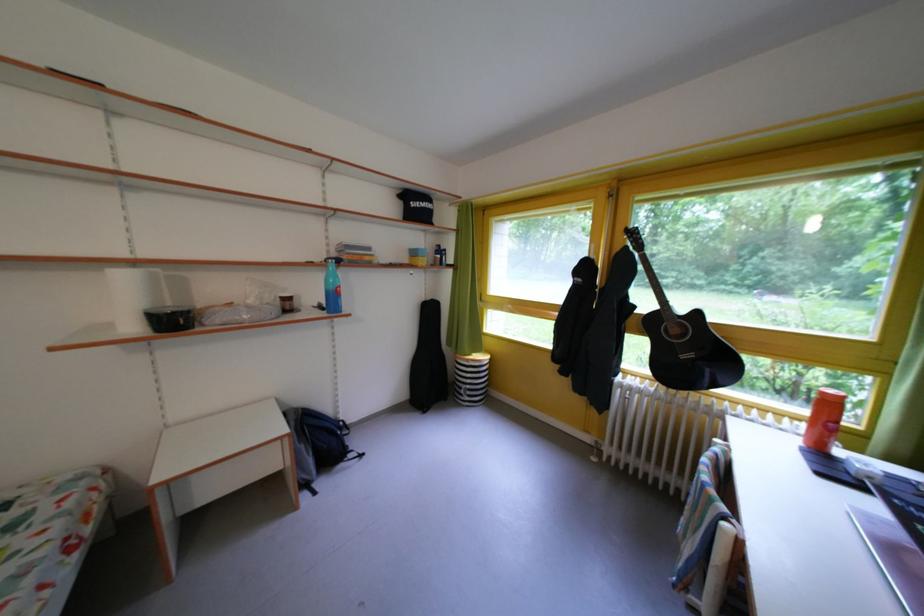
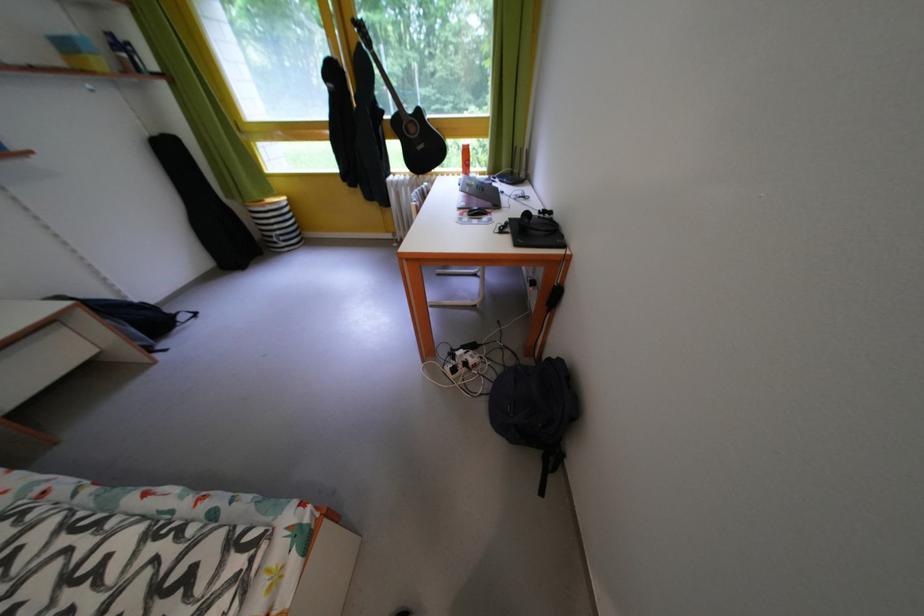
The point at [478,392] is marked in the first image. Where is the corresponding point in the second image?

(287, 238)